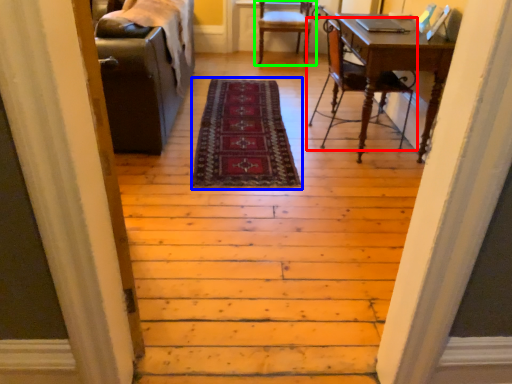
Question: Which object is the closest to the chair (highlighted by a red box)? Choose among these: mat (highlighted by a blue box) or chair (highlighted by a green box).

Choices:
 (A) mat
 (B) chair

Answer: (A)